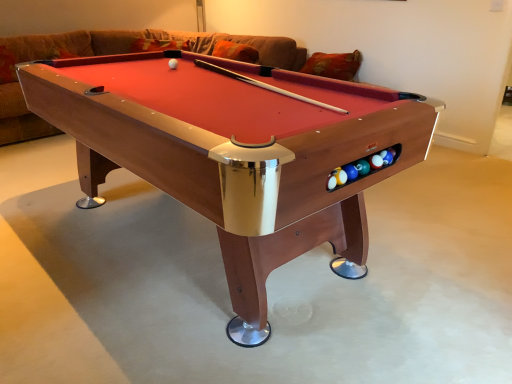
Question: Does point (287, 167) appear closer or farther from the camera than point (168, 61)?

Choices:
 (A) closer
 (B) farther

Answer: (A)

Question: Is wooden billiard table at center situated inside white matte ball at center or outside?

Choices:
 (A) inside
 (B) outside

Answer: (B)

Question: Which object is the farthest from the brown fabric couch at upper center?

Choices:
 (A) wooden billiard table at center
 (B) white matte ball at center

Answer: (A)

Question: Considering the real-world distances, which object is closest to the wooden billiard table at center?

Choices:
 (A) white matte ball at center
 (B) brown fabric couch at upper center

Answer: (A)